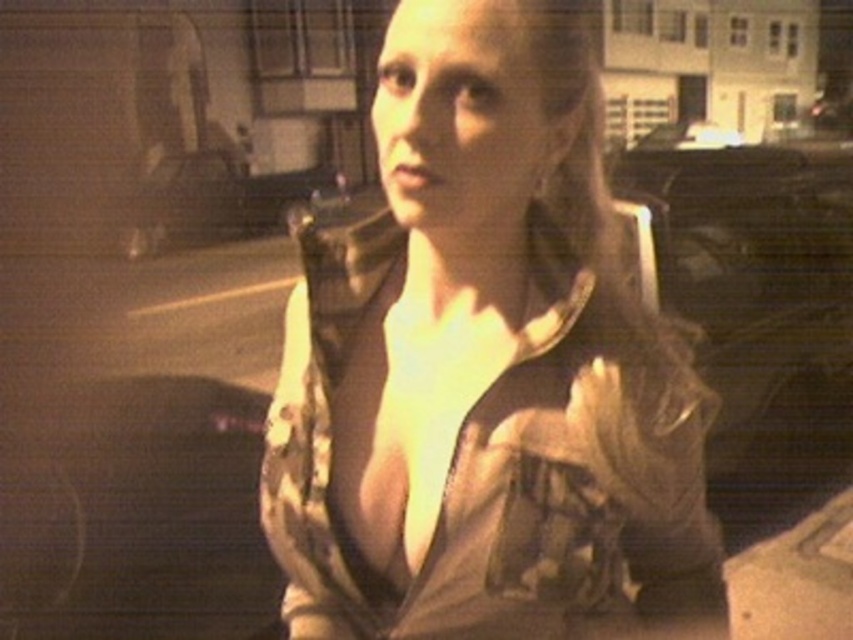
Question: Can you confirm if camo fabric jacket at center is wider than metallic silver car at center?

Choices:
 (A) yes
 (B) no

Answer: (B)

Question: Which point is farther to the camera?

Choices:
 (A) camo fabric jacket at center
 (B) metallic silver car at center

Answer: (B)

Question: Does camo fabric jacket at center have a smaller size compared to metallic silver car at center?

Choices:
 (A) no
 (B) yes

Answer: (B)

Question: Is camo fabric jacket at center positioned at the back of metallic silver car at center?

Choices:
 (A) no
 (B) yes

Answer: (A)